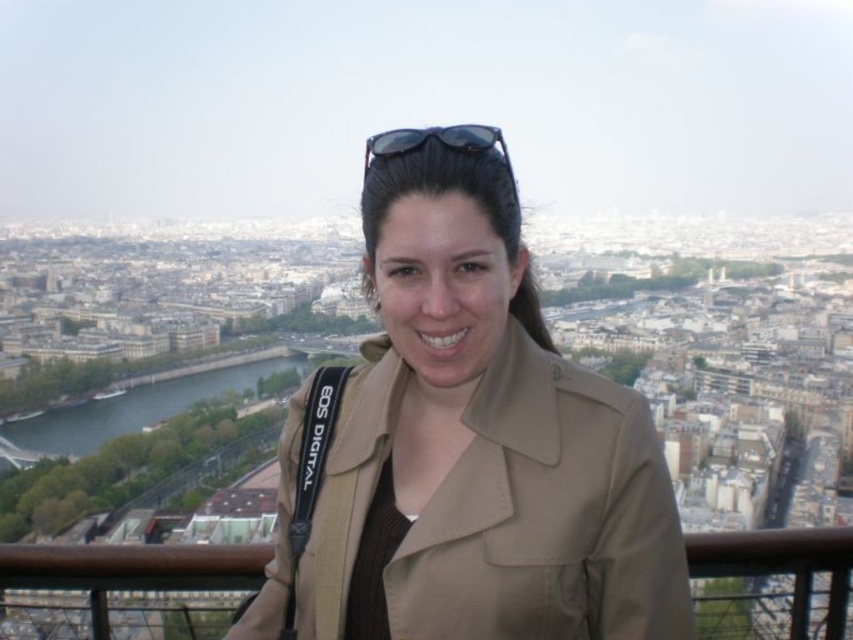
From the picture: You are a photographer standing at the center of a cityscape overlooking a river. You notice a tan fabric jacket at center. Where exactly is the tan fabric jacket located in terms of coordinates?

The tan fabric jacket at center is located at coordinates point (471, 449).

Consider the image. You are a fashion designer observing the scene. You need to decide which item, the tan fabric jacket at center or the sunglasses at center, would require more fabric to produce. Based on their sizes in the image, which one would need more material?

The sunglasses at center would require more fabric to produce since the tan fabric jacket at center is smaller than the sunglasses at center in the image.